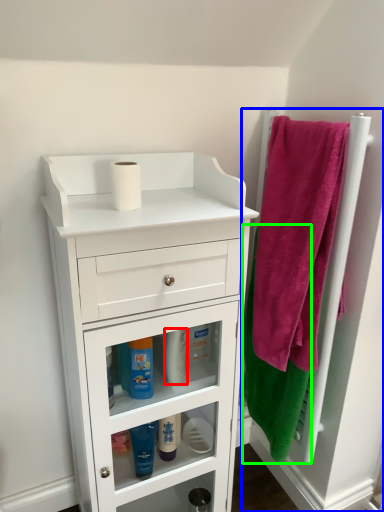
Question: Which object is positioned closest to toiletry (highlighted by a red box)? Select from door (highlighted by a blue box) and bath towel (highlighted by a green box).

Choices:
 (A) door
 (B) bath towel

Answer: (B)